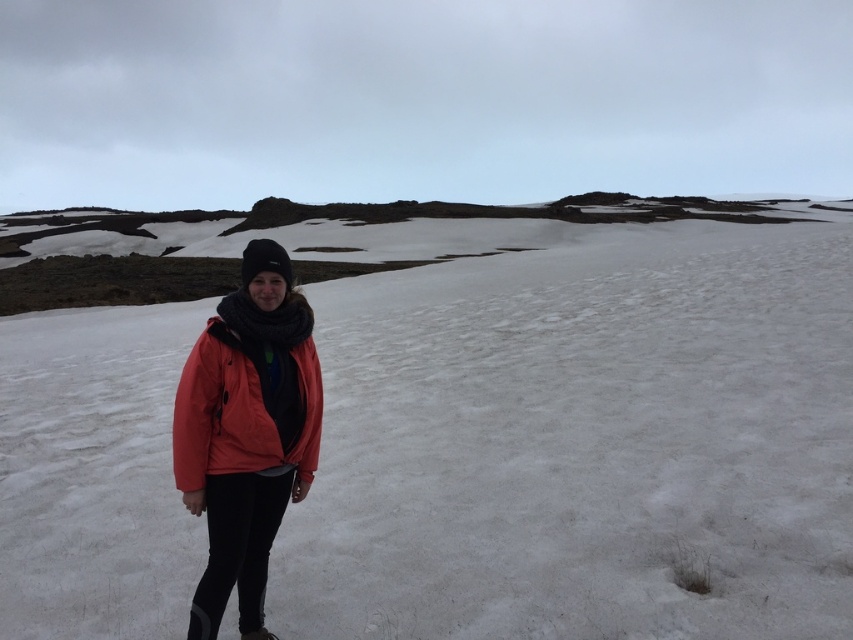
Is white powdery snow at center bigger than matte orange jacket at center?

Yes, white powdery snow at center is bigger than matte orange jacket at center.

Which is below, white powdery snow at center or matte orange jacket at center?

matte orange jacket at center is below.

Does point (740, 330) come in front of point (271, 376)?

No, (740, 330) is further to viewer.

Find the location of a particular element. The image size is (853, 640). white powdery snow at center is located at coordinates (577, 435).